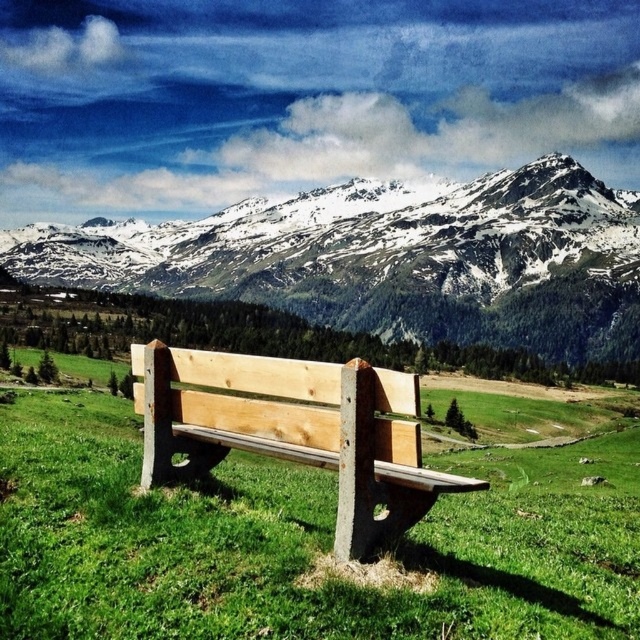
You are standing at the wooden bench and want to walk towards the mountain range. There are two points marked in the image, point 1 at coordinates point (188, 532) and point 2 at coordinates point (269, 356). Which point should you walk towards to get closer to the mountains?

You should walk towards point 1 at coordinates point (188, 532) because it is in front of point 2 at coordinates point (269, 356), meaning it is closer to the mountain range in the background.

You are standing in the middle of the natural green grass at center and want to walk towards the snowy granite mountain range at upper center. Which direction should you head?

Since the natural green grass at center is to the right of the snowy granite mountain range at upper center, you should head to the left to walk towards the snowy granite mountain range at upper center.